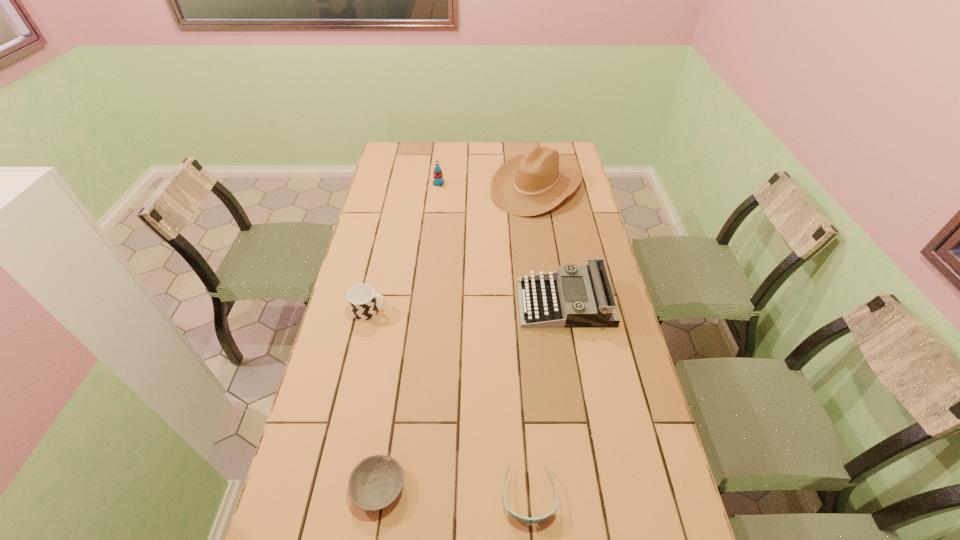
The width and height of the screenshot is (960, 540). In order to click on free spot between the fourth tallest object and the goggles in this screenshot , I will do `click(449, 403)`.

This screenshot has height=540, width=960. What are the coordinates of `empty location between the soda and the typewriter` in the screenshot? It's located at click(502, 243).

Find the location of a particular element. vacant space in between the soda and the goggles is located at coordinates (484, 340).

The width and height of the screenshot is (960, 540). In order to click on vacant region between the soda and the cowboy hat in this screenshot , I will do `click(488, 185)`.

Identify the location of object that is the nearest to the tallest object. (438, 176).

The height and width of the screenshot is (540, 960). I want to click on object that ranks as the closest to the cup, so click(x=556, y=299).

You are a GUI agent. You are given a task and a screenshot of the screen. Output one action in this format:
    pyautogui.click(x=<x>, y=<y>)
    Task: Click on the free space that satisfies the following two spatial constraints: 1. on the front side of the tallest object; 2. on the side of the cup with the handle
    
    Given the screenshot: What is the action you would take?
    pyautogui.click(x=555, y=312)

Locate an element on the screen. vacant space that satisfies the following two spatial constraints: 1. on the typing side of the typewriter; 2. on the front-facing side of the goggles is located at coordinates coord(599,496).

The image size is (960, 540). In order to click on free point that satisfies the following two spatial constraints: 1. on the back side of the bowl; 2. on the side of the fourth tallest object with the handle in this screenshot , I will do `click(405, 312)`.

Where is `free spot that satisfies the following two spatial constraints: 1. on the front side of the soda; 2. on the side of the fourth tallest object with the handle`? free spot that satisfies the following two spatial constraints: 1. on the front side of the soda; 2. on the side of the fourth tallest object with the handle is located at coordinates (424, 312).